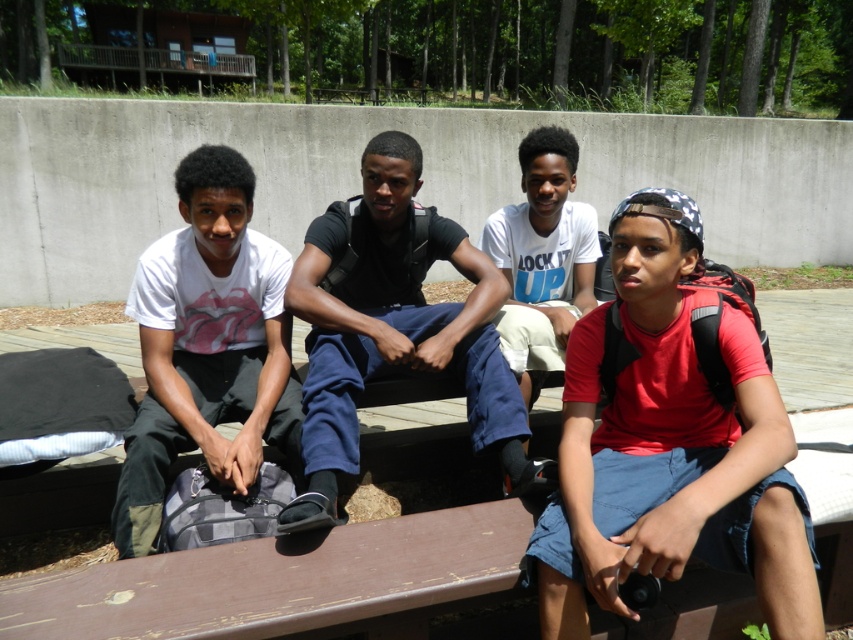
You are standing at the origin point in the image. Which direction should you move to reach the red matte shirt at right?

Since the red matte shirt at right is located at coordinates approximately 0.700 on the x and 0.787 on the y axis, you should move towards the upper right direction from your current position to reach it.

Looking at this image, you are a photographer trying to capture a group photo of the red matte shirt at right and the white cotton shirt at center. Since you want to ensure both are clearly visible, which person should you position closer to the camera to avoid being overshadowed?

The white cotton shirt at center should be positioned closer to the camera because it is smaller than the red matte shirt at right, ensuring both are visible.